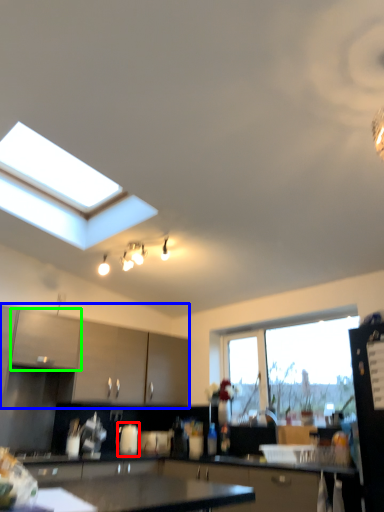
Question: Which object is positioned farthest from appliance (highlighted by a red box)? Select from cabinetry (highlighted by a blue box) and cabinetry (highlighted by a green box).

Choices:
 (A) cabinetry
 (B) cabinetry

Answer: (B)